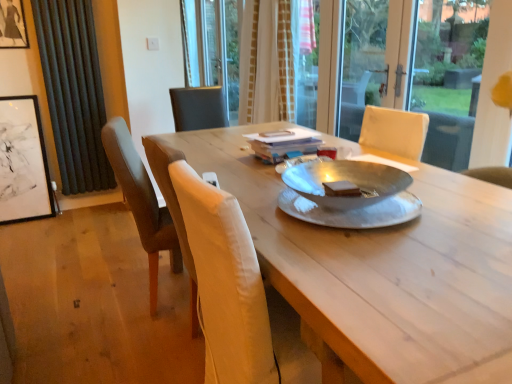
Question: Is matte black picture frame at upper left, placed as the 2th picture frame when sorted from bottom to top, a part of brown leather chair at left?

Choices:
 (A) yes
 (B) no

Answer: (B)

Question: Can you confirm if brown leather chair at left is bigger than matte black picture frame at upper left, placed as the 2th picture frame when sorted from bottom to top?

Choices:
 (A) yes
 (B) no

Answer: (A)

Question: Can you confirm if brown leather chair at left is thinner than matte black picture frame at upper left, arranged as the 1th picture frame when viewed from the top?

Choices:
 (A) yes
 (B) no

Answer: (B)

Question: Does brown leather chair at left have a smaller size compared to matte black picture frame at upper left, arranged as the 1th picture frame when viewed from the top?

Choices:
 (A) no
 (B) yes

Answer: (A)

Question: Is brown leather chair at left oriented towards matte black picture frame at upper left, placed as the 2th picture frame when sorted from bottom to top?

Choices:
 (A) no
 (B) yes

Answer: (A)

Question: Is brown leather chair at left to the left of matte black picture frame at upper left, arranged as the 1th picture frame when viewed from the top, from the viewer's perspective?

Choices:
 (A) no
 (B) yes

Answer: (A)

Question: Does white textured curtain at center, which is counted as the first curtain, starting from the right, have a greater height compared to matte black picture frame at upper left, placed as the 2th picture frame when sorted from bottom to top?

Choices:
 (A) yes
 (B) no

Answer: (A)

Question: Is white textured curtain at center, which is counted as the first curtain, starting from the right, touching matte black picture frame at upper left, placed as the 2th picture frame when sorted from bottom to top?

Choices:
 (A) no
 (B) yes

Answer: (A)

Question: Is white textured curtain at center, which is the second curtain from left to right, aimed at matte black picture frame at upper left, placed as the 2th picture frame when sorted from bottom to top?

Choices:
 (A) yes
 (B) no

Answer: (A)

Question: Considering the relative positions of white textured curtain at center, which is the second curtain from left to right, and matte black picture frame at upper left, placed as the 2th picture frame when sorted from bottom to top, in the image provided, is white textured curtain at center, which is the second curtain from left to right, to the right of matte black picture frame at upper left, placed as the 2th picture frame when sorted from bottom to top, from the viewer's perspective?

Choices:
 (A) no
 (B) yes

Answer: (B)

Question: Are white textured curtain at center, which is the second curtain from left to right, and matte black picture frame at upper left, placed as the 2th picture frame when sorted from bottom to top, far apart?

Choices:
 (A) no
 (B) yes

Answer: (B)

Question: From the image's perspective, is white textured curtain at center, which is counted as the first curtain, starting from the right, located beneath matte black picture frame at upper left, placed as the 2th picture frame when sorted from bottom to top?

Choices:
 (A) no
 (B) yes

Answer: (B)

Question: From the image's perspective, is wooden table at center under transparent glass screen door at upper center?

Choices:
 (A) no
 (B) yes

Answer: (B)